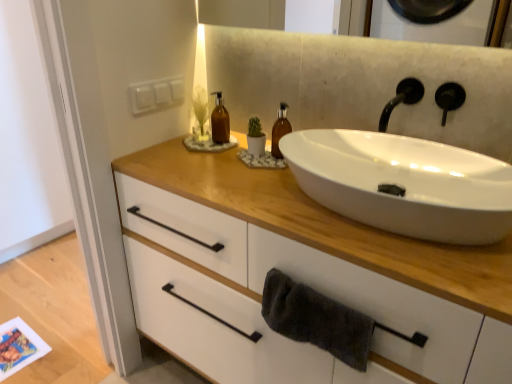
The height and width of the screenshot is (384, 512). What are the coordinates of `white ceramic sink at center` in the screenshot? It's located at (404, 183).

Measure the distance between white matte cabinet at center and camera.

They are 70.51 centimeters apart.

What is the approximate height of translucent amber bottle at center, which is the second bottle in left-to-right order?

The height of translucent amber bottle at center, which is the second bottle in left-to-right order, is 6.76 inches.

This screenshot has width=512, height=384. I want to click on black matte tap at upper right, so click(401, 99).

The width and height of the screenshot is (512, 384). What are the coordinates of `white ceramic sink at center` in the screenshot? It's located at (404, 183).

Consider the image. Is dark gray towel at lower center taller than white ceramic sink at center?

Indeed, dark gray towel at lower center has a greater height compared to white ceramic sink at center.

Is white ceramic sink at center located within dark gray towel at lower center?

No, white ceramic sink at center is located outside of dark gray towel at lower center.

Consider the image. Considering the relative sizes of translucent amber bottle at center, the first bottle when ordered from right to left, and dark gray towel at lower center in the image provided, is translucent amber bottle at center, the first bottle when ordered from right to left, taller than dark gray towel at lower center?

Yes.

Could you tell me if translucent amber bottle at center, the first bottle when ordered from right to left, is turned towards dark gray towel at lower center?

No, translucent amber bottle at center, the first bottle when ordered from right to left, is not oriented towards dark gray towel at lower center.

Visually, is translucent amber bottle at center, which is the second bottle in left-to-right order, positioned to the left or to the right of dark gray towel at lower center?

Based on their positions, translucent amber bottle at center, which is the second bottle in left-to-right order, is located to the left of dark gray towel at lower center.

From the image's perspective, is translucent amber bottle at center, the first bottle when ordered from right to left, located beneath dark gray towel at lower center?

Incorrect, from the image's perspective, translucent amber bottle at center, the first bottle when ordered from right to left, is higher than dark gray towel at lower center.

Which of these two, dark gray towel at lower center or translucent amber bottle at center, which is the second bottle in left-to-right order, is bigger?

dark gray towel at lower center.

Who is taller, dark gray towel at lower center or translucent amber bottle at center, which is the second bottle in left-to-right order?

translucent amber bottle at center, which is the second bottle in left-to-right order, is taller.

Is translucent amber bottle at center, which is the second bottle in left-to-right order, inside dark gray towel at lower center?

No, translucent amber bottle at center, which is the second bottle in left-to-right order, is not a part of dark gray towel at lower center.

Does dark gray towel at lower center turn towards translucent amber bottle at center, which is the second bottle in left-to-right order?

No, dark gray towel at lower center is not facing towards translucent amber bottle at center, which is the second bottle in left-to-right order.

Could you tell me if dark gray towel at lower center is facing white matte cabinet at center?

Yes, dark gray towel at lower center is aimed at white matte cabinet at center.

Is dark gray towel at lower center closer to camera compared to white matte cabinet at center?

No, it is not.

Is dark gray towel at lower center smaller than white matte cabinet at center?

Indeed, dark gray towel at lower center has a smaller size compared to white matte cabinet at center.

Does point (282, 299) appear closer or farther from the camera than point (457, 264)?

Point (282, 299) appears to be farther away from the viewer than point (457, 264).

From the image's perspective, does black matte tap at upper right appear lower than translucent amber bottle at center, the first bottle when ordered from right to left?

No.

Is black matte tap at upper right to the right of translucent amber bottle at center, the first bottle when ordered from right to left, from the viewer's perspective?

Indeed, black matte tap at upper right is positioned on the right side of translucent amber bottle at center, the first bottle when ordered from right to left.

Considering the sizes of black matte tap at upper right and translucent amber bottle at center, the first bottle when ordered from right to left, in the image, is black matte tap at upper right taller or shorter than translucent amber bottle at center, the first bottle when ordered from right to left,?

Considering their sizes, black matte tap at upper right has less height than translucent amber bottle at center, the first bottle when ordered from right to left.

How different are the orientations of black matte tap at upper right and translucent amber bottle at center, the first bottle when ordered from right to left, in degrees?

0.0019 degrees separate the facing orientations of black matte tap at upper right and translucent amber bottle at center, the first bottle when ordered from right to left.

Is white ceramic sink at center at the left side of brown glass bottle at center, the first bottle viewed from the left?

No, white ceramic sink at center is not to the left of brown glass bottle at center, the first bottle viewed from the left.

Is white ceramic sink at center located outside brown glass bottle at center, acting as the second bottle starting from the right?

Yes, white ceramic sink at center is located beyond the bounds of brown glass bottle at center, acting as the second bottle starting from the right.

In the image, is white ceramic sink at center positioned in front of or behind brown glass bottle at center, the first bottle viewed from the left?

Clearly, white ceramic sink at center is in front of brown glass bottle at center, the first bottle viewed from the left.

From a real-world perspective, is white ceramic sink at center above or below brown glass bottle at center, acting as the second bottle starting from the right?

white ceramic sink at center is situated lower than brown glass bottle at center, acting as the second bottle starting from the right, in the real world.

From a real-world perspective, is white ceramic sink at center physically located above or below white matte cabinet at center?

Clearly, from a real-world perspective, white ceramic sink at center is above white matte cabinet at center.

From the image's perspective, does white ceramic sink at center appear higher than white matte cabinet at center?

Correct, white ceramic sink at center appears higher than white matte cabinet at center in the image.

Can you confirm if white ceramic sink at center is positioned to the left of white matte cabinet at center?

No, white ceramic sink at center is not to the left of white matte cabinet at center.

Can you confirm if white ceramic sink at center is shorter than white matte cabinet at center?

Indeed, white ceramic sink at center has a lesser height compared to white matte cabinet at center.

You are a GUI agent. You are given a task and a screenshot of the screen. Output one action in this format:
    pyautogui.click(x=<x>, y=<y>)
    Task: Click on the sink on the right of dark gray towel at lower center
    
    Given the screenshot: What is the action you would take?
    pyautogui.click(x=404, y=183)

From the dark gray towel at lower center, count 1st bottles backward and point to it. Please provide its 2D coordinates.

[(280, 130)]

Considering their positions, is white matte cabinet at center positioned further to translucent amber bottle at center, the first bottle when ordered from right to left, than dark gray towel at lower center?

dark gray towel at lower center is further to translucent amber bottle at center, the first bottle when ordered from right to left.

From the image, which object appears to be farther from dark gray towel at lower center, white matte cabinet at center or translucent amber bottle at center, the first bottle when ordered from right to left?

The object further to dark gray towel at lower center is translucent amber bottle at center, the first bottle when ordered from right to left.

From the picture: From the image, which object appears to be nearer to dark gray towel at lower center, brown glass bottle at center, the first bottle viewed from the left, or translucent amber bottle at center, which is the second bottle in left-to-right order?

translucent amber bottle at center, which is the second bottle in left-to-right order, is positioned closer to the anchor dark gray towel at lower center.

Looking at the image, which one is located closer to dark gray towel at lower center, translucent amber bottle at center, which is the second bottle in left-to-right order, or black matte tap at upper right?

The object closer to dark gray towel at lower center is translucent amber bottle at center, which is the second bottle in left-to-right order.

Estimate the real-world distances between objects in this image. Which object is further from translucent amber bottle at center, the first bottle when ordered from right to left, dark gray towel at lower center or black matte tap at upper right?

dark gray towel at lower center.

Estimate the real-world distances between objects in this image. Which object is further from white ceramic sink at center, black matte tap at upper right or dark gray towel at lower center?

The object further to white ceramic sink at center is dark gray towel at lower center.

Looking at this image, considering their positions, is translucent amber bottle at center, the first bottle when ordered from right to left, positioned further to dark gray towel at lower center than brown glass bottle at center, acting as the second bottle starting from the right?

Based on the image, brown glass bottle at center, acting as the second bottle starting from the right, appears to be further to dark gray towel at lower center.

Which object lies further to the anchor point dark gray towel at lower center, black matte tap at upper right or translucent amber bottle at center, the first bottle when ordered from right to left?

The object further to dark gray towel at lower center is black matte tap at upper right.

Where is `tap between white ceramic sink at center and translucent amber bottle at center, which is the second bottle in left-to-right order, in the front-back direction`? The image size is (512, 384). tap between white ceramic sink at center and translucent amber bottle at center, which is the second bottle in left-to-right order, in the front-back direction is located at coordinates (401, 99).

Find the location of `tap located between white ceramic sink at center and brown glass bottle at center, acting as the second bottle starting from the right, in the depth direction`. tap located between white ceramic sink at center and brown glass bottle at center, acting as the second bottle starting from the right, in the depth direction is located at coordinates (401, 99).

What are the coordinates of `bottle that lies between black matte tap at upper right and white matte cabinet at center from top to bottom` in the screenshot? It's located at (280, 130).

The image size is (512, 384). What are the coordinates of `bath towel positioned between white ceramic sink at center and brown glass bottle at center, the first bottle viewed from the left, from near to far` in the screenshot? It's located at (316, 319).